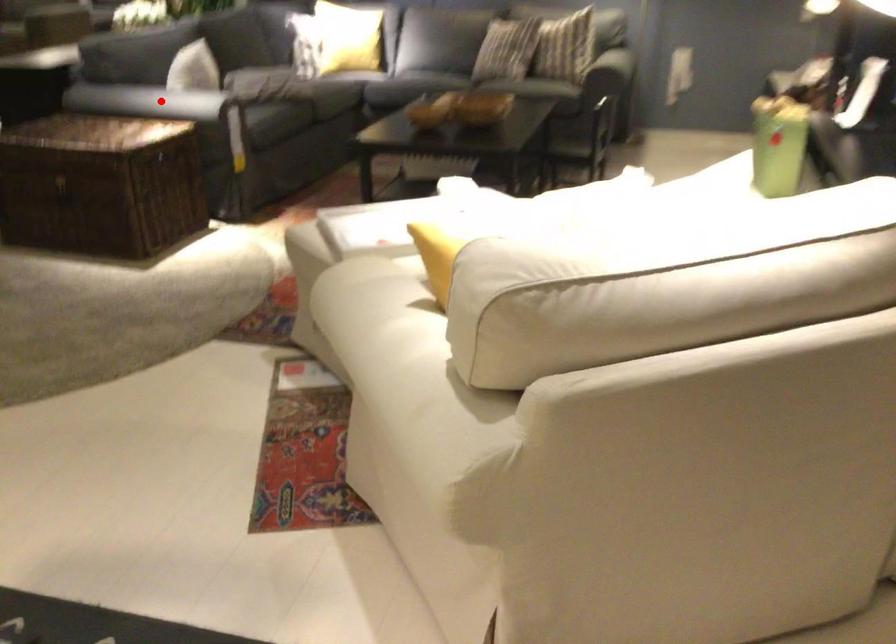
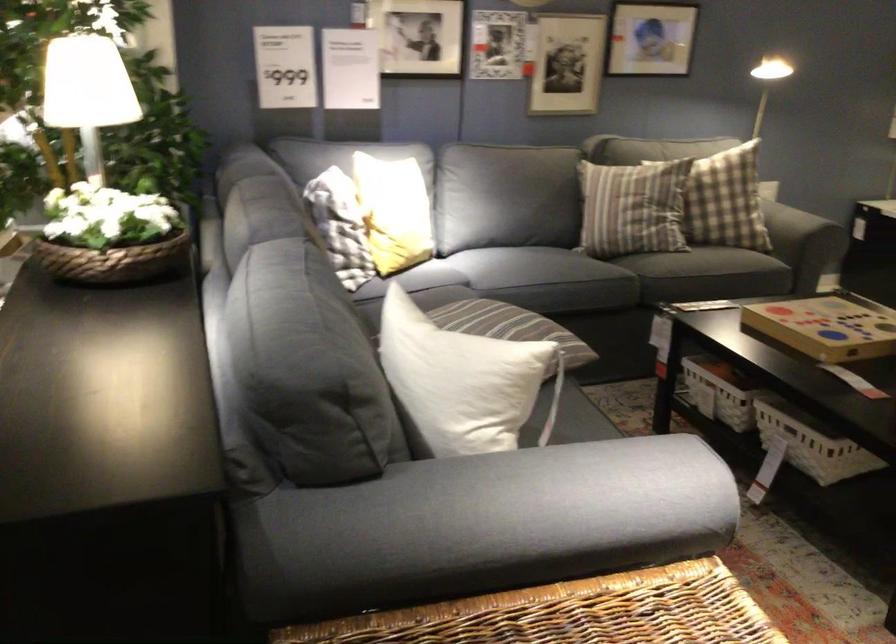
Question: I am providing you with two images of the same scene from different viewpoints. A red point is marked on the first image. Can you still see the location of the red point in image 2?

Choices:
 (A) Yes
 (B) No

Answer: (A)